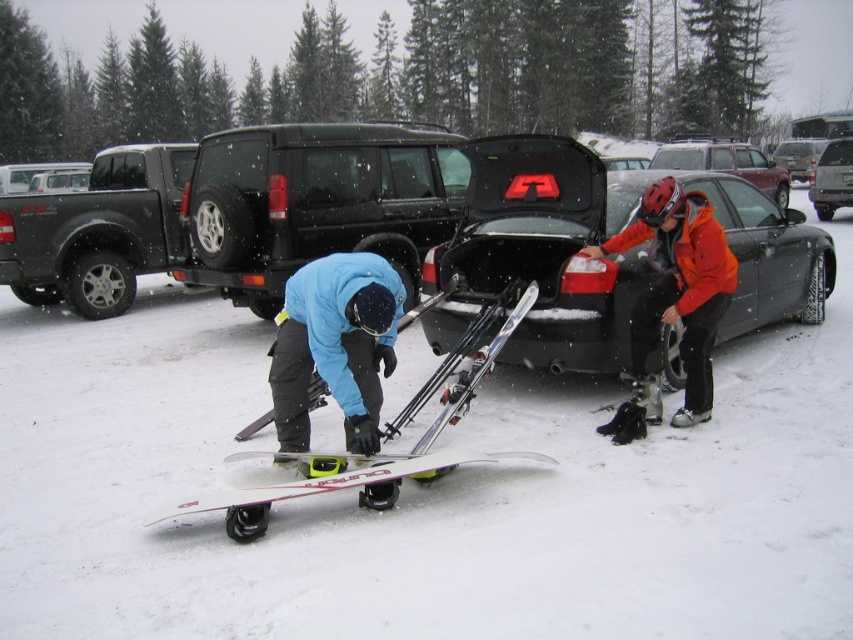
Question: Which object is closer to the camera taking this photo?

Choices:
 (A) orange matte jacket at center
 (B) black matte suv at center

Answer: (A)

Question: Which is farther from the white matte snowboard at lower center?

Choices:
 (A) matte blue snowboard at center
 (B) black matte suv at center
 (C) matte black truck at left

Answer: (C)

Question: Does black matte suv at center have a lesser width compared to orange matte jacket at center?

Choices:
 (A) yes
 (B) no

Answer: (B)

Question: In this image, where is black matte car trunk at center located relative to black matte suv at center?

Choices:
 (A) below
 (B) above

Answer: (A)

Question: Considering the relative positions of matte blue snowboard at center and white matte snowboard at lower center in the image provided, where is matte blue snowboard at center located with respect to white matte snowboard at lower center?

Choices:
 (A) right
 (B) left

Answer: (B)

Question: Among these points, which one is nearest to the camera?

Choices:
 (A) 27,200
 (B) 219,204
 (C) 740,157
 (D) 440,468

Answer: (D)